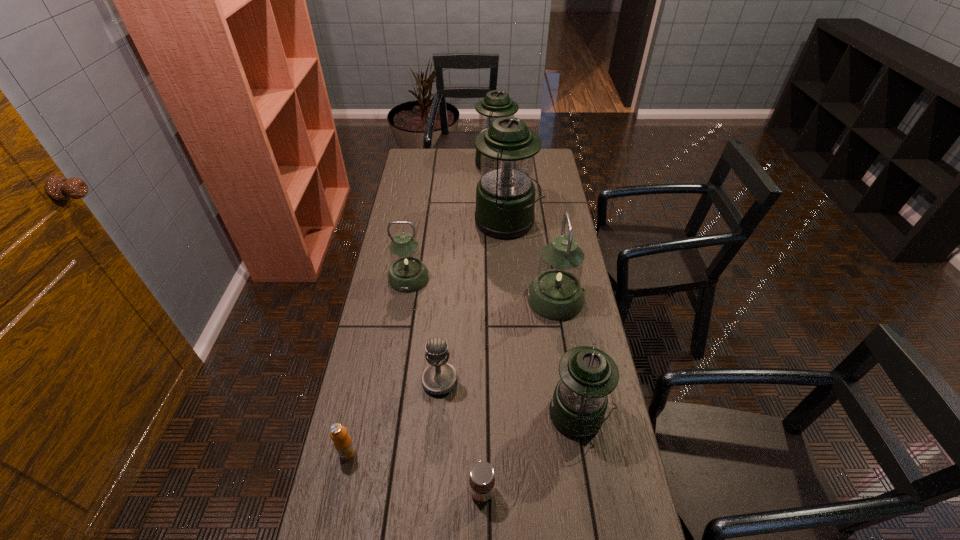
Image resolution: width=960 pixels, height=540 pixels. In order to click on empty space between the microphone and the nearest green lantern in this screenshot , I will do `click(509, 399)`.

The image size is (960, 540). Find the location of `empty location between the farthest object and the third object from left to right`. empty location between the farthest object and the third object from left to right is located at coordinates (468, 273).

Locate which object ranks third in proximity to the second smallest green lantern. Please provide its 2D coordinates. Your answer should be formatted as a tuple, i.e. [(x, y)], where the tuple contains the x and y coordinates of a point satisfying the conditions above.

[(556, 293)]

The width and height of the screenshot is (960, 540). I want to click on object that is the seventh closest to the nearest lantern, so click(496, 104).

Find the location of a particular element. lantern that is the nearest to the shortest object is located at coordinates (577, 409).

Locate which lantern ranks second in proximity to the nearest lantern. Please provide its 2D coordinates. Your answer should be formatted as a tuple, i.e. [(x, y)], where the tuple contains the x and y coordinates of a point satisfying the conditions above.

[(407, 274)]

Identify the location of green lantern that is the second closest to the tallest lantern. (577, 409).

In order to click on green lantern that stands as the closest to the nearest green lantern in this screenshot , I will do `click(505, 195)`.

Find the location of a particular element. This screenshot has height=540, width=960. vacant space that satisfies the following two spatial constraints: 1. on the front side of the tallest lantern; 2. on the label side of the shortest object is located at coordinates pyautogui.click(x=526, y=491).

Image resolution: width=960 pixels, height=540 pixels. I want to click on vacant space that satisfies the following two spatial constraints: 1. on the front side of the leftmost lantern; 2. on the left side of the right greenish lantern, so pos(405,299).